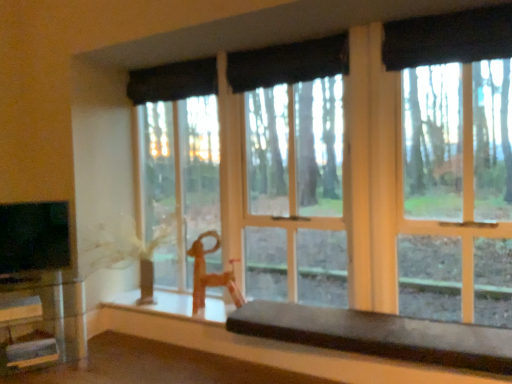
The image size is (512, 384). What are the coordinates of `black fabric curtain at upper center, the fourth curtain positioned from the back` in the screenshot? It's located at (449, 38).

Locate an element on the screen. This screenshot has height=384, width=512. black fabric curtain at upper right, placed as the 3th curtain when sorted from back to front is located at coordinates (448, 38).

What is the approximate height of black fabric curtain at upper center, the third curtain positioned from the front?

10.81 inches.

Describe the element at coordinates (45, 328) in the screenshot. I see `clear glass table at lower left, the first table viewed from the left` at that location.

Identify the location of black glossy tv at left. (33, 238).

Does point (290, 318) come behind point (432, 115)?

No.

Is the surface of smooth dark brown bench at lower center, arranged as the 2th table when viewed from the left, in direct contact with transparent glass window at center?

smooth dark brown bench at lower center, arranged as the 2th table when viewed from the left, is not next to transparent glass window at center, and they're not touching.

Which object is wider, smooth dark brown bench at lower center, arranged as the 2th table when viewed from the left, or transparent glass window at center?

Wider between the two is smooth dark brown bench at lower center, arranged as the 2th table when viewed from the left.

This screenshot has width=512, height=384. Identify the location of window above the smooth dark brown bench at lower center, arranged as the 2th table when viewed from the left (from a real-world perspective). (377, 169).

Is black fabric curtain at upper center, which is the second curtain in back-to-front order, wider than smooth dark brown bench at lower center, the 1th table viewed from the right?

Incorrect, the width of black fabric curtain at upper center, which is the second curtain in back-to-front order, does not surpass that of smooth dark brown bench at lower center, the 1th table viewed from the right.

From the image's perspective, is black fabric curtain at upper center, the third curtain positioned from the front, below smooth dark brown bench at lower center, the 1th table viewed from the right?

No, from the image's perspective, black fabric curtain at upper center, the third curtain positioned from the front, is not below smooth dark brown bench at lower center, the 1th table viewed from the right.

Would you say black fabric curtain at upper center, which is the second curtain in back-to-front order, is inside or outside smooth dark brown bench at lower center, the 1th table viewed from the right?

black fabric curtain at upper center, which is the second curtain in back-to-front order, cannot be found inside smooth dark brown bench at lower center, the 1th table viewed from the right.

What's the angular difference between black fabric curtain at upper center, the third curtain positioned from the front, and smooth dark brown bench at lower center, arranged as the 2th table when viewed from the left,'s facing directions?

They differ by 2.74 degrees in their facing directions.

Can you confirm if transparent glass window at center is bigger than black fabric curtain at upper center, placed as the first curtain when sorted from back to front?

Yes, transparent glass window at center is bigger than black fabric curtain at upper center, placed as the first curtain when sorted from back to front.

Is transparent glass window at center in front of or behind black fabric curtain at upper center, placed as the first curtain when sorted from back to front, in the image?

Visually, transparent glass window at center is located in front of black fabric curtain at upper center, placed as the first curtain when sorted from back to front.

Is transparent glass window at center completely or partially outside of black fabric curtain at upper center, the 4th curtain from the front?

Absolutely, transparent glass window at center is external to black fabric curtain at upper center, the 4th curtain from the front.

What are the coordinates of `curtain that is the 2nd one when counting upward from the black fabric curtain at upper center, the 4th curtain from the front (from the image's perspective)` in the screenshot? It's located at (449, 38).

Is black fabric curtain at upper center, the 4th curtain from the front, shorter than black fabric curtain at upper center, the fourth curtain positioned from the back?

Incorrect, the height of black fabric curtain at upper center, the 4th curtain from the front, does not fall short of that of black fabric curtain at upper center, the fourth curtain positioned from the back.

Is black fabric curtain at upper center, the 4th curtain from the front, bigger or smaller than black fabric curtain at upper center, which is the first curtain from front to back?

Considering their sizes, black fabric curtain at upper center, the 4th curtain from the front, takes up less space than black fabric curtain at upper center, which is the first curtain from front to back.

Are black fabric curtain at upper center, which is the first curtain from front to back, and clear glass table at lower left, the first table viewed from the left, beside each other?

No, black fabric curtain at upper center, which is the first curtain from front to back, is not in contact with clear glass table at lower left, the first table viewed from the left.

In the scene shown: Is black fabric curtain at upper center, the fourth curtain positioned from the back, aimed at clear glass table at lower left, the first table viewed from the left?

No, black fabric curtain at upper center, the fourth curtain positioned from the back, is not turned towards clear glass table at lower left, the first table viewed from the left.

Is black fabric curtain at upper center, which is the first curtain from front to back, taller than clear glass table at lower left, positioned as the second table in right-to-left order?

In fact, black fabric curtain at upper center, which is the first curtain from front to back, may be shorter than clear glass table at lower left, positioned as the second table in right-to-left order.

From the image's perspective, between black fabric curtain at upper center, which is the first curtain from front to back, and clear glass table at lower left, positioned as the second table in right-to-left order, who is located below?

clear glass table at lower left, positioned as the second table in right-to-left order, from the image's perspective.

Between transparent glass window at center and black fabric curtain at upper center, the third curtain positioned from the front, which one appears on the right side from the viewer's perspective?

From the viewer's perspective, transparent glass window at center appears more on the right side.

Is transparent glass window at center thinner than black fabric curtain at upper center, which is the second curtain in back-to-front order?

No.

Is transparent glass window at center positioned with its back to black fabric curtain at upper center, the third curtain positioned from the front?

Absolutely, transparent glass window at center is directed away from black fabric curtain at upper center, the third curtain positioned from the front.

Looking at this image, can you see transparent glass window at center touching black fabric curtain at upper center, which is the second curtain in back-to-front order?

No, transparent glass window at center is not beside black fabric curtain at upper center, which is the second curtain in back-to-front order.

Considering the relative sizes of transparent glass window at center and black fabric curtain at upper right, placed as the 3th curtain when sorted from back to front, in the image provided, is transparent glass window at center wider than black fabric curtain at upper right, placed as the 3th curtain when sorted from back to front,?

Yes.

Is transparent glass window at center positioned with its back to black fabric curtain at upper right, which ranks as the second curtain in front-to-back order?

Yes.

Consider the image. Which is more to the left, transparent glass window at center or black fabric curtain at upper right, placed as the 3th curtain when sorted from back to front?

transparent glass window at center.

Is transparent glass window at center not near black fabric curtain at upper right, placed as the 3th curtain when sorted from back to front?

No, transparent glass window at center is not far from black fabric curtain at upper right, placed as the 3th curtain when sorted from back to front.

What are the coordinates of `window lying on the left of smooth dark brown bench at lower center, the 1th table viewed from the right` in the screenshot? It's located at (377, 169).

Where is `the 1st table below the black fabric curtain at upper center, which is the second curtain in back-to-front order (from the image's perspective)`? The image size is (512, 384). the 1st table below the black fabric curtain at upper center, which is the second curtain in back-to-front order (from the image's perspective) is located at coordinates (378, 335).

Estimate the real-world distances between objects in this image. Which object is further from black fabric curtain at upper center, which is the second curtain in back-to-front order, black fabric curtain at upper center, the fourth curtain positioned from the back, or black fabric curtain at upper right, placed as the 3th curtain when sorted from back to front?

black fabric curtain at upper right, placed as the 3th curtain when sorted from back to front.

When comparing their distances from black fabric curtain at upper center, the third curtain positioned from the front, does black fabric curtain at upper center, the fourth curtain positioned from the back, or clear glass table at lower left, the first table viewed from the left, seem closer?

black fabric curtain at upper center, the fourth curtain positioned from the back.

Which object lies further to the anchor point black fabric curtain at upper center, the third curtain positioned from the front, transparent glass window at center or black fabric curtain at upper center, the 4th curtain from the front?

black fabric curtain at upper center, the 4th curtain from the front, lies further to black fabric curtain at upper center, the third curtain positioned from the front, than the other object.

Estimate the real-world distances between objects in this image. Which object is further from black glossy tv at left, transparent glass window at center or black fabric curtain at upper right, placed as the 3th curtain when sorted from back to front?

black fabric curtain at upper right, placed as the 3th curtain when sorted from back to front, is positioned further to the anchor black glossy tv at left.

Estimate the real-world distances between objects in this image. Which object is closer to black fabric curtain at upper right, which ranks as the second curtain in front-to-back order, smooth dark brown bench at lower center, the 1th table viewed from the right, or black fabric curtain at upper center, placed as the first curtain when sorted from back to front?

Among the two, smooth dark brown bench at lower center, the 1th table viewed from the right, is located nearer to black fabric curtain at upper right, which ranks as the second curtain in front-to-back order.

Considering their positions, is black glossy tv at left positioned closer to black fabric curtain at upper right, placed as the 3th curtain when sorted from back to front, than black fabric curtain at upper center, the fourth curtain positioned from the back?

black fabric curtain at upper center, the fourth curtain positioned from the back, is closer to black fabric curtain at upper right, placed as the 3th curtain when sorted from back to front.

Estimate the real-world distances between objects in this image. Which object is further from transparent glass window at center, smooth dark brown bench at lower center, the 1th table viewed from the right, or black glossy tv at left?

Based on the image, black glossy tv at left appears to be further to transparent glass window at center.

Estimate the real-world distances between objects in this image. Which object is closer to transparent glass window at center, black fabric curtain at upper center, the 4th curtain from the front, or black fabric curtain at upper center, which is the second curtain in back-to-front order?

black fabric curtain at upper center, which is the second curtain in back-to-front order, is closer to transparent glass window at center.

This screenshot has width=512, height=384. Identify the location of level located between clear glass table at lower left, positioned as the second table in right-to-left order, and transparent glass window at center in the left-right direction. (33, 238).

You are a GUI agent. You are given a task and a screenshot of the screen. Output one action in this format:
    pyautogui.click(x=<x>, y=<y>)
    Task: Click on the window between black fabric curtain at upper center, placed as the first curtain when sorted from back to front, and smooth dark brown bench at lower center, the 1th table viewed from the right, from top to bottom
    Image resolution: width=512 pixels, height=384 pixels.
    Given the screenshot: What is the action you would take?
    377,169

This screenshot has width=512, height=384. Identify the location of table between clear glass table at lower left, the first table viewed from the left, and black fabric curtain at upper right, which ranks as the second curtain in front-to-back order, in the horizontal direction. (378, 335).

Where is `table between black fabric curtain at upper center, the fourth curtain positioned from the back, and clear glass table at lower left, positioned as the second table in right-to-left order, vertically`? table between black fabric curtain at upper center, the fourth curtain positioned from the back, and clear glass table at lower left, positioned as the second table in right-to-left order, vertically is located at coordinates (378, 335).